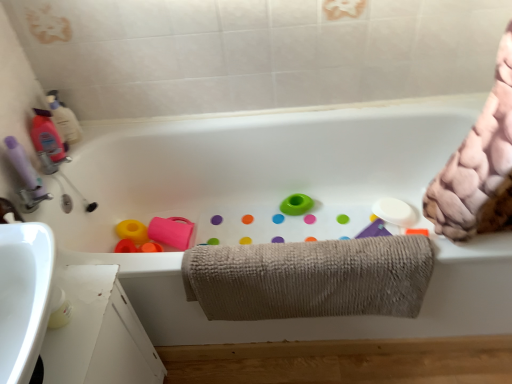
Question: Does translucent plastic bottle at upper left, which ranks as the third cleaning product in bottom-to-top order, have a smaller size compared to beige textured towel at center?

Choices:
 (A) no
 (B) yes

Answer: (B)

Question: From a real-world perspective, is translucent plastic bottle at upper left, which ranks as the third cleaning product in bottom-to-top order, beneath beige textured towel at center?

Choices:
 (A) no
 (B) yes

Answer: (A)

Question: Is the depth of translucent plastic bottle at upper left, which ranks as the third cleaning product in bottom-to-top order, less than that of beige textured towel at center?

Choices:
 (A) no
 (B) yes

Answer: (A)

Question: Can you confirm if translucent plastic bottle at upper left, arranged as the 1th cleaning product when viewed from the top, is bigger than beige textured towel at center?

Choices:
 (A) no
 (B) yes

Answer: (A)

Question: Is translucent plastic bottle at upper left, arranged as the 1th cleaning product when viewed from the top, shorter than beige textured towel at center?

Choices:
 (A) no
 (B) yes

Answer: (B)

Question: From a real-world perspective, is translucent plastic bottle at upper left, which ranks as the third cleaning product in bottom-to-top order, on beige textured towel at center?

Choices:
 (A) yes
 (B) no

Answer: (A)

Question: Does white ceramic bathtub at center have a lesser width compared to purple matte bottle at left, marked as the third cleaning product in a top-to-bottom arrangement?

Choices:
 (A) no
 (B) yes

Answer: (A)

Question: Is white ceramic bathtub at center smaller than purple matte bottle at left, marked as the third cleaning product in a top-to-bottom arrangement?

Choices:
 (A) yes
 (B) no

Answer: (B)

Question: Is white ceramic bathtub at center in front of purple matte bottle at left, which ranks as the first cleaning product in bottom-to-top order?

Choices:
 (A) no
 (B) yes

Answer: (B)

Question: From the image's perspective, is white ceramic bathtub at center located above purple matte bottle at left, which ranks as the first cleaning product in bottom-to-top order?

Choices:
 (A) yes
 (B) no

Answer: (B)

Question: Is purple matte bottle at left, marked as the third cleaning product in a top-to-bottom arrangement, surrounded by white ceramic bathtub at center?

Choices:
 (A) yes
 (B) no

Answer: (B)

Question: Can you confirm if white ceramic bathtub at center is taller than purple matte bottle at left, marked as the third cleaning product in a top-to-bottom arrangement?

Choices:
 (A) yes
 (B) no

Answer: (A)

Question: From the image's perspective, is matte pink bottle at left, acting as the 2th cleaning product starting from the bottom, above translucent plastic bottle at upper left, arranged as the 1th cleaning product when viewed from the top?

Choices:
 (A) no
 (B) yes

Answer: (A)